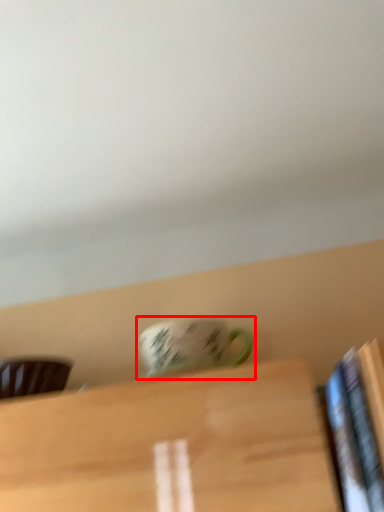
Question: In this image, where is coffee cup (annotated by the red box) located relative to chair?

Choices:
 (A) right
 (B) left

Answer: (A)